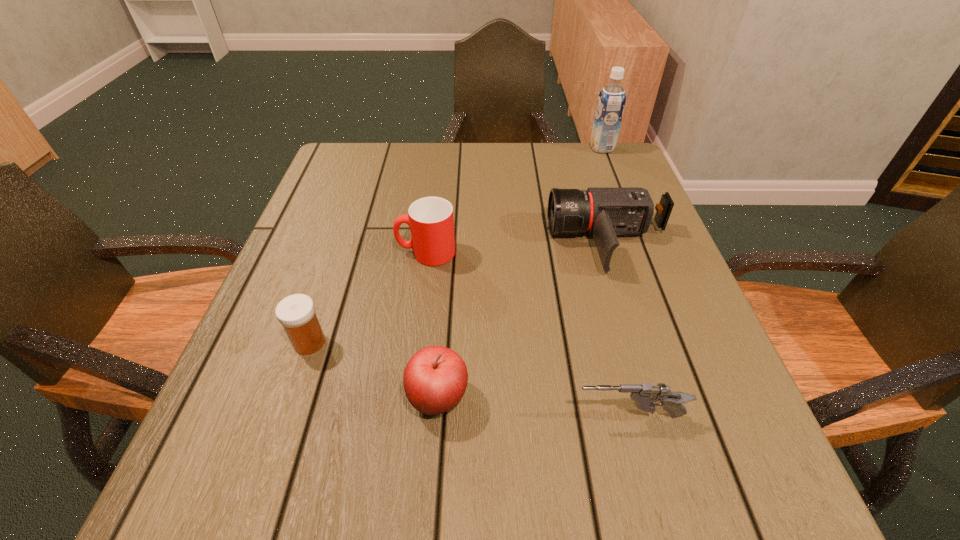
This screenshot has width=960, height=540. I want to click on free space located on the label of the tallest object, so click(509, 148).

Locate an element on the screen. This screenshot has height=540, width=960. vacant point located 0.070m on the side of the cup with the handle is located at coordinates (364, 253).

Locate an element on the screen. free location located 0.050m on the side of the cup with the handle is located at coordinates (373, 253).

The height and width of the screenshot is (540, 960). What are the coordinates of `vacant area situated 0.350m on the lens of the camcorder` in the screenshot? It's located at (389, 242).

Locate an element on the screen. free space located on the lens of the camcorder is located at coordinates (426, 242).

Locate an element on the screen. The height and width of the screenshot is (540, 960). blank space located 0.200m on the lens of the camcorder is located at coordinates [x=458, y=242].

Find the location of `free spot located on the left of the apple`. free spot located on the left of the apple is located at coordinates (300, 397).

Locate an element on the screen. vacant position located 0.100m on the front of the medicine is located at coordinates (286, 410).

Find the location of a particular element. vacant space located at the barrel of the gun is located at coordinates (383, 416).

Locate an element on the screen. The image size is (960, 540). free space located at the barrel of the gun is located at coordinates (501, 416).